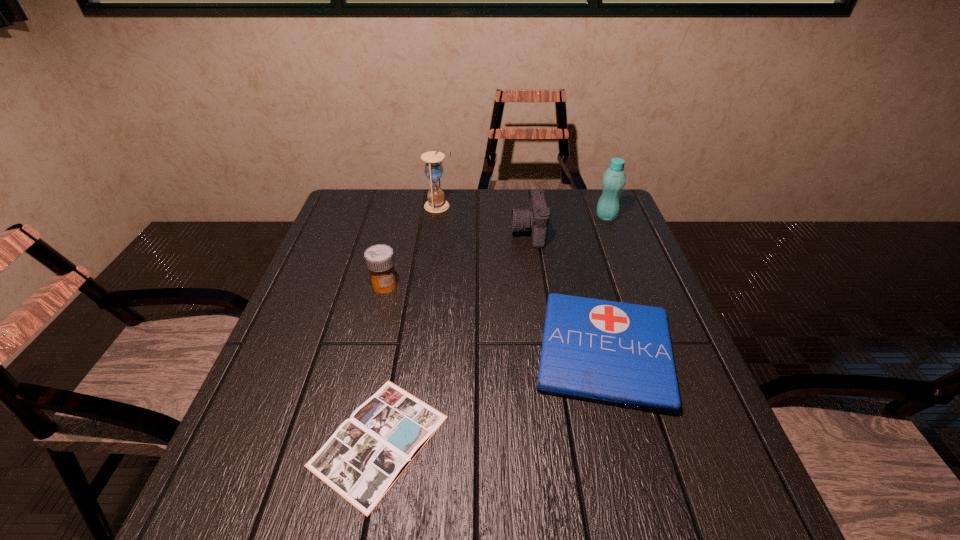
Where is `hourglass`? The width and height of the screenshot is (960, 540). hourglass is located at coordinates (433, 168).

Identify the location of bottle. The image size is (960, 540). (614, 178).

The width and height of the screenshot is (960, 540). Identify the location of camera. (535, 219).

At what (x,y) coordinates should I click in order to perform the action: click on medicine. Please return your answer as a coordinate pair (x, y). Image resolution: width=960 pixels, height=540 pixels. Looking at the image, I should click on (379, 258).

Locate an element on the screen. Image resolution: width=960 pixels, height=540 pixels. the first-aid kit is located at coordinates (616, 353).

At what (x,y) coordinates should I click in order to perform the action: click on book. Please return your answer as a coordinate pair (x, y). The height and width of the screenshot is (540, 960). Looking at the image, I should click on [x=364, y=457].

Identify the location of free point located 0.060m on the back of the hourglass. The image size is (960, 540). (441, 190).

The height and width of the screenshot is (540, 960). In order to click on blank space located on the left of the bottle in this screenshot , I will do pos(507,217).

The width and height of the screenshot is (960, 540). What are the coordinates of `vacant area located 0.250m at the lens of the camera` in the screenshot? It's located at (429, 232).

Where is `blank space located at the lens of the camera`? This screenshot has height=540, width=960. blank space located at the lens of the camera is located at coordinates (469, 232).